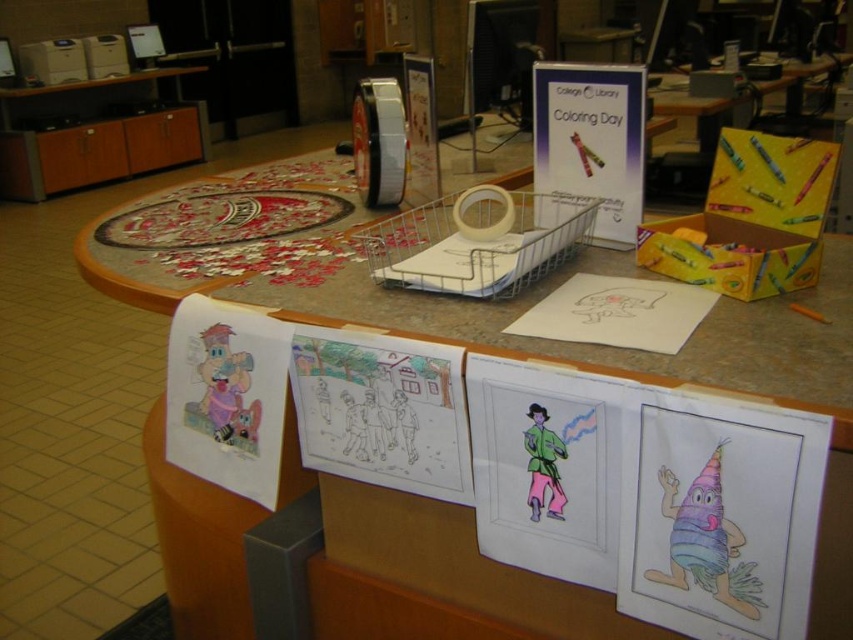
Who is lower down, smooth brown countertop at center or orange matte crayon at center?

Positioned lower is orange matte crayon at center.

Is smooth brown countertop at center bigger than orange matte crayon at center?

Indeed, smooth brown countertop at center has a larger size compared to orange matte crayon at center.

The width and height of the screenshot is (853, 640). In order to click on smooth brown countertop at center in this screenshot , I will do `click(454, 298)`.